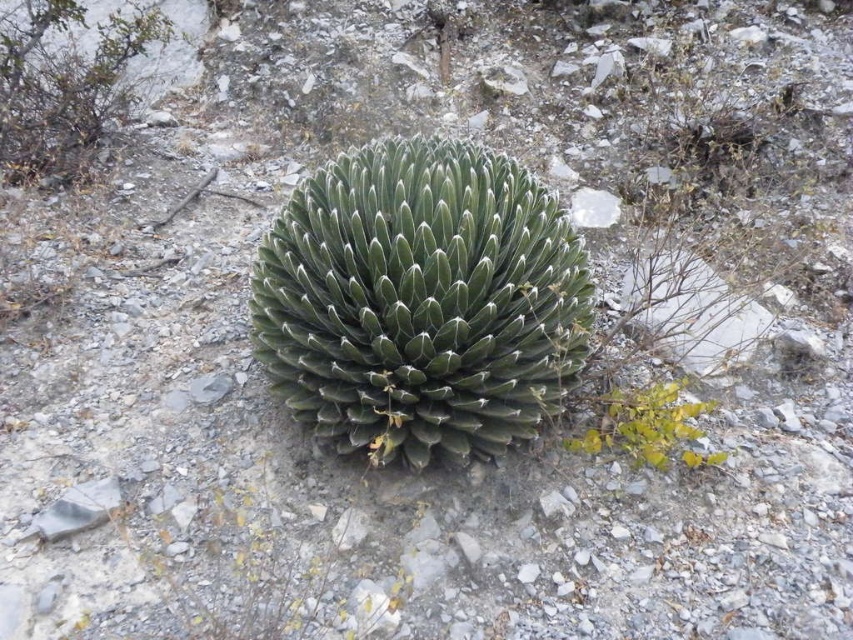
You are a hiker who just arrived at this desert scene. You see a point marked at coordinates (67, 83). What object is located at that point?

The point at coordinates (67, 83) marks the green spiky cactus at upper left.

You are a hiker trying to navigate through the desert. You see the green spiky cactus at upper left and the green leafy plant at lower right. Which plant is closer to you?

The green spiky cactus at upper left is closer to you because the green leafy plant at lower right is behind it.